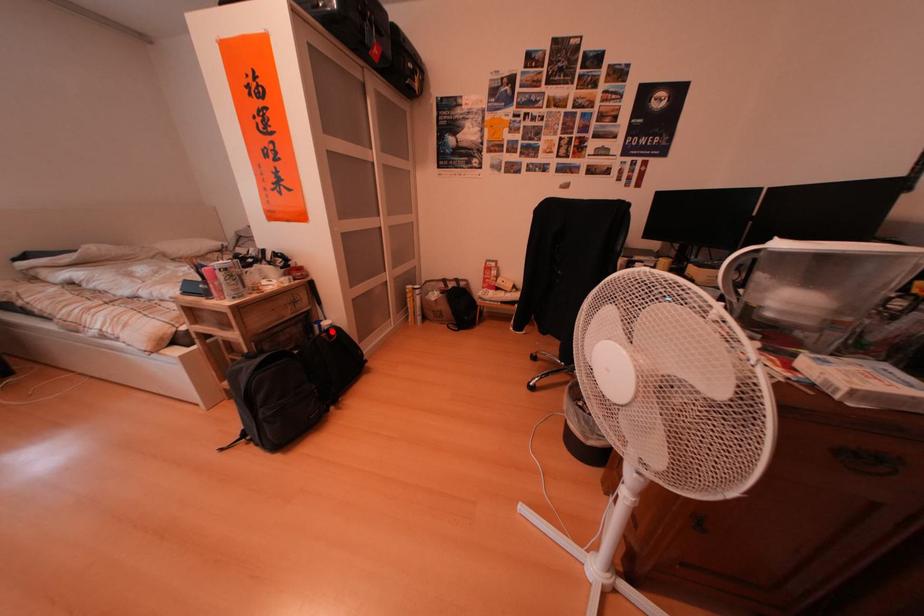
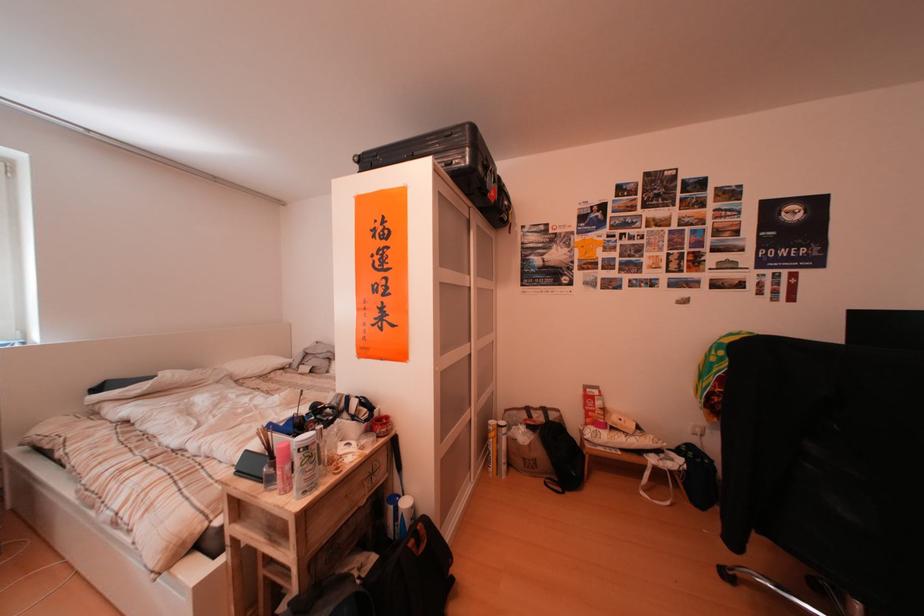
Find the pixel in the second image that matches the highlighted location in the first image.

(408, 515)